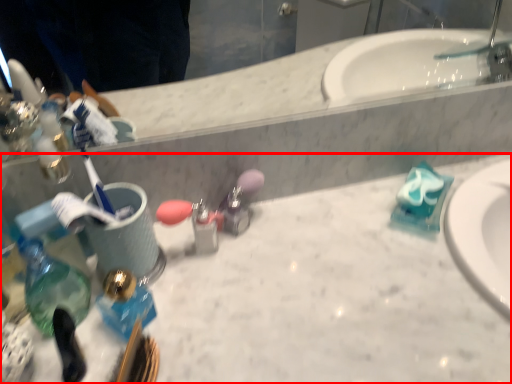
Question: In this image, where is counter top (annotated by the red box) located relative to bottle?

Choices:
 (A) right
 (B) left

Answer: (A)